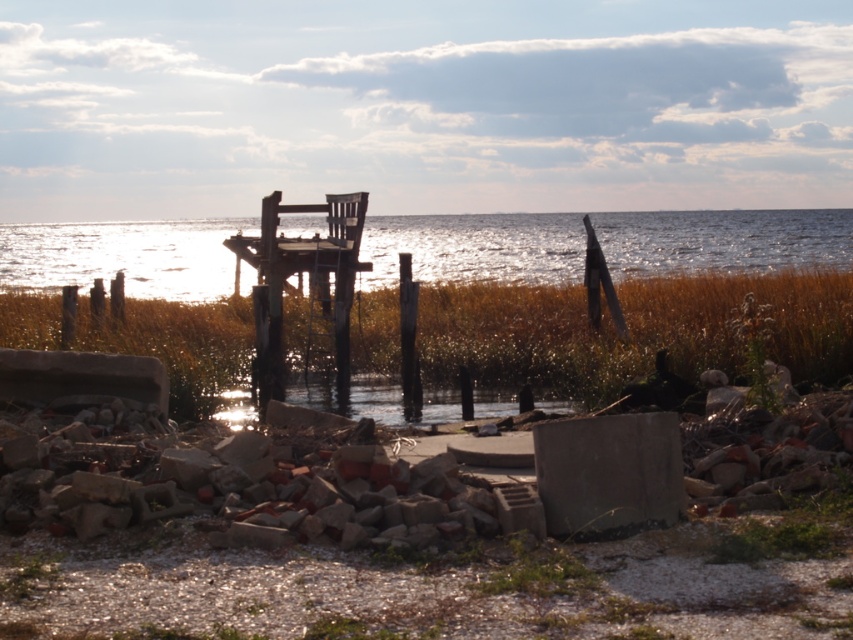
You are standing on the wooden dock at center and want to reach the glistening water at center. Which direction should you move to get there?

The glistening water at center is positioned on the right side of wooden dock at center, so you should move to the right to reach it.